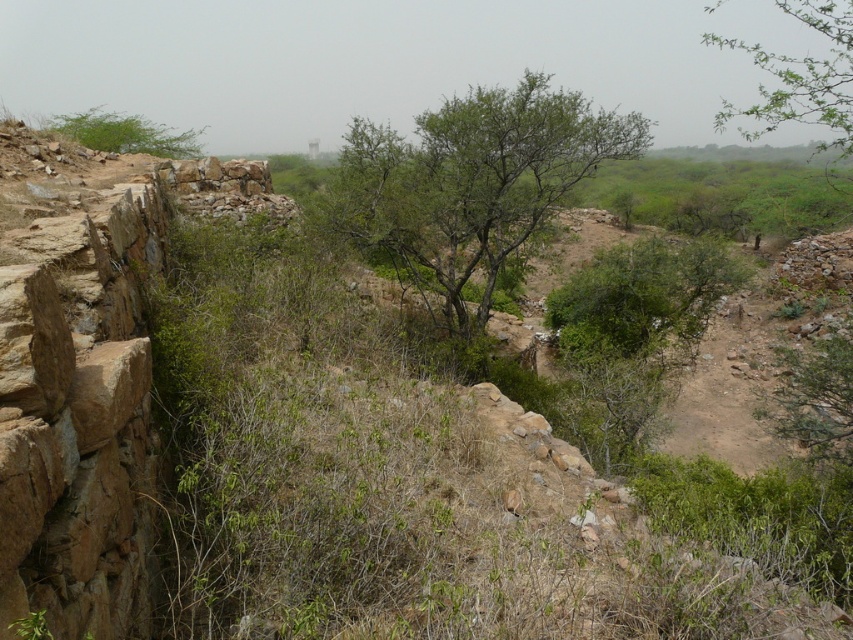
Question: Which point is farther to the camera?

Choices:
 (A) green leafy tree at center
 (B) brown rough stone cliff at left

Answer: (A)

Question: Which of the following is the farthest from the observer?

Choices:
 (A) green leafy tree at center
 (B) green leafy tree at upper right
 (C) green leafy shrub at upper left

Answer: (C)

Question: Can you confirm if green leafy tree at upper right is positioned to the left of green leafy shrub at upper left?

Choices:
 (A) yes
 (B) no

Answer: (B)

Question: Which of these objects is positioned closest to the green leafy tree at upper right?

Choices:
 (A) green leafy shrub at upper left
 (B) green leafy tree at center

Answer: (B)

Question: Can you confirm if green leafy tree at upper right is thinner than green leafy shrub at upper left?

Choices:
 (A) yes
 (B) no

Answer: (B)

Question: Does green leafy tree at center have a larger size compared to green leafy tree at upper right?

Choices:
 (A) yes
 (B) no

Answer: (B)